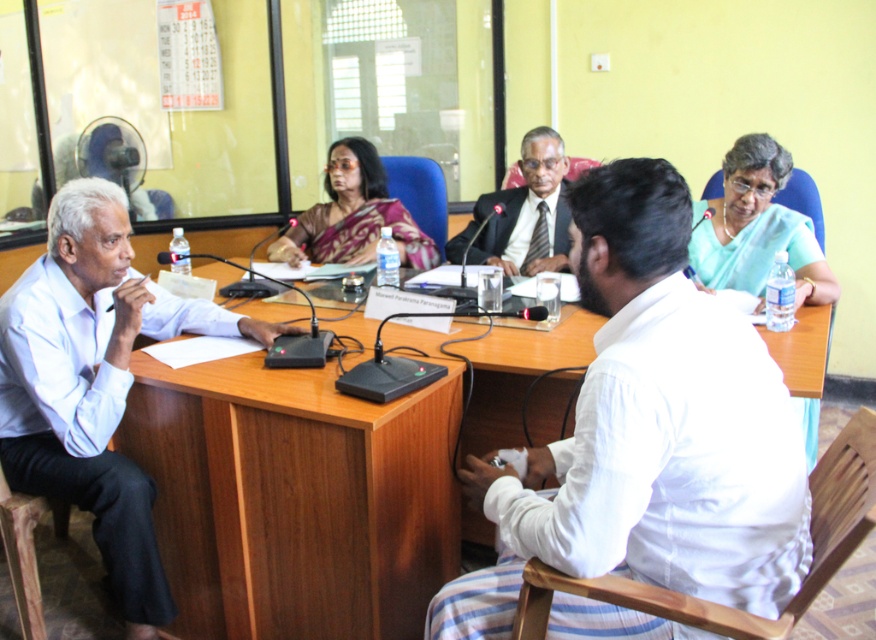
What is the color of the object located at point (352,216)?

The object at point (352,216) is a satin sari at center, which is described as being in the center of the image. However, the scene description does not provide specific color information about the satin sari. Therefore, the color cannot be determined from the given information.

Where is the satin sari at center located in the image?

The satin sari at center is located at point [352,216] in the image.